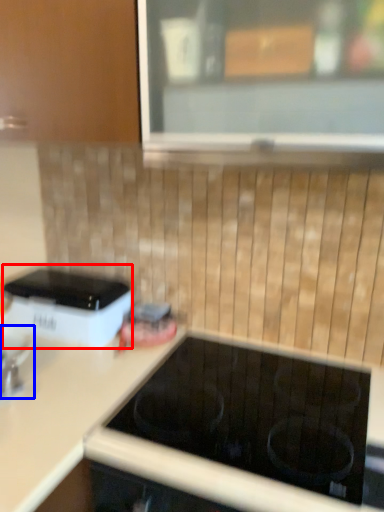
Question: Which point is closer to the camera, home appliance (highlighted by a red box) or appliance (highlighted by a blue box)?

Choices:
 (A) home appliance
 (B) appliance

Answer: (B)